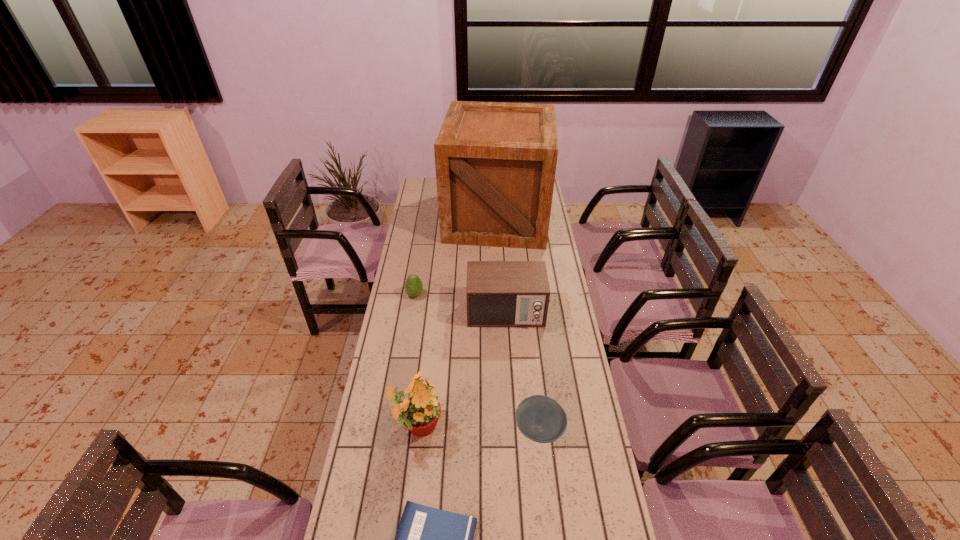
The height and width of the screenshot is (540, 960). I want to click on blank area at the far left corner, so coord(422,185).

The height and width of the screenshot is (540, 960). Find the location of `vacant space that is in between the farthest object and the fourth tallest object`. vacant space that is in between the farthest object and the fourth tallest object is located at coordinates (456, 256).

Identify the location of vacant space that's between the third tallest object and the flowerpot. (462, 369).

The height and width of the screenshot is (540, 960). What are the coordinates of `free space between the bowl and the third tallest object` in the screenshot? It's located at (522, 370).

Identify the location of vacant area that lies between the flowerpot and the box. (457, 322).

You are a GUI agent. You are given a task and a screenshot of the screen. Output one action in this format:
    pyautogui.click(x=<x>, y=<y>)
    Task: Click on the blank region between the flowerpot and the bowl
    This screenshot has width=960, height=540.
    Given the screenshot: What is the action you would take?
    pyautogui.click(x=478, y=428)

The width and height of the screenshot is (960, 540). I want to click on free space between the fifth shortest object and the avocado, so click(416, 361).

Point out which object is positioned as the nearest to the nearest object. Please provide its 2D coordinates. Your answer should be formatted as a tuple, i.e. [(x, y)], where the tuple contains the x and y coordinates of a point satisfying the conditions above.

[(419, 411)]

I want to click on object that stands as the fifth closest to the tallest object, so click(428, 539).

Where is `free space that satisfies the following two spatial constraints: 1. on the front side of the second shortest object; 2. on the right side of the flowerpot`? The height and width of the screenshot is (540, 960). free space that satisfies the following two spatial constraints: 1. on the front side of the second shortest object; 2. on the right side of the flowerpot is located at coordinates (417, 429).